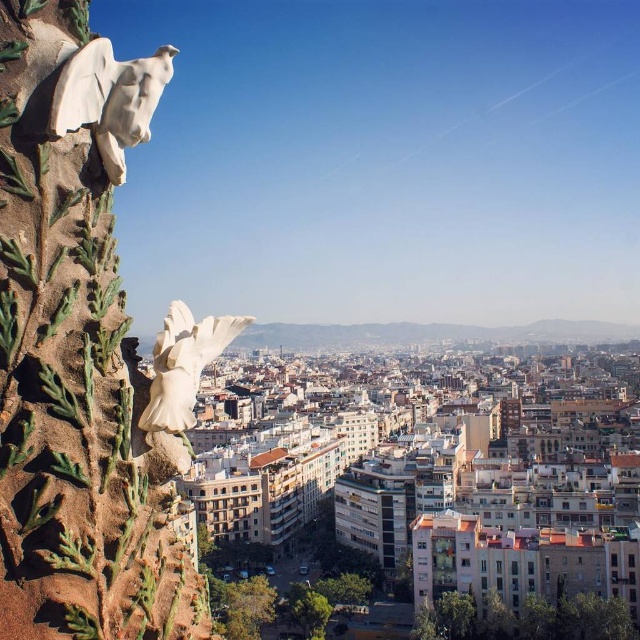
You are an architect designing a new city sculpture. You want to place a new statue that must be shorter than both the white stone eagle at upper left and the white glossy bird at upper left. Which one should you use as the reference for height?

The white stone eagle at upper left is much taller than the white glossy bird at upper left. Therefore, you should use the white glossy bird at upper left as the reference for height since it is shorter.

You are an architect analyzing the cityscape. You notice two birds in the upper left corner. Which one is positioned higher between the white stone eagle at upper left and the white glossy bird at upper left?

The white stone eagle at upper left is positioned higher than the white glossy bird at upper left according to the description.

You are an architect designing a new city plaza and want to place both the white stone eagle at upper left and the white glossy bird at upper left on a wall. Since both sculptures are at the upper left, how can you arrange them so that their sizes are noticeable to visitors?

Place the white stone eagle at upper left closer to the wall and the white glossy bird at upper left further away. Since the white stone eagle at upper left is smaller, positioning it closer will make it appear larger in comparison, while the larger white glossy bird at upper left placed farther back will seem smaller, creating a visual contrast between their actual sizes.